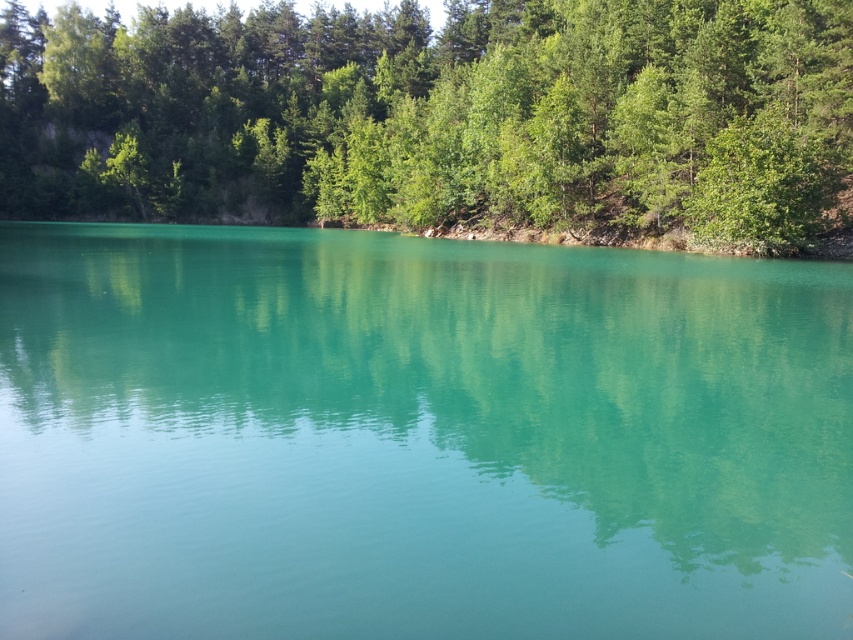
Question: Does turquoise glossy water at center have a lesser width compared to green leafy trees at upper center?

Choices:
 (A) no
 (B) yes

Answer: (B)

Question: Which object appears closest to the camera in this image?

Choices:
 (A) green leafy trees at upper center
 (B) turquoise glossy water at center

Answer: (B)

Question: Is turquoise glossy water at center bigger than green leafy trees at upper center?

Choices:
 (A) no
 (B) yes

Answer: (A)

Question: Is turquoise glossy water at center further to the viewer compared to green leafy trees at upper center?

Choices:
 (A) yes
 (B) no

Answer: (B)